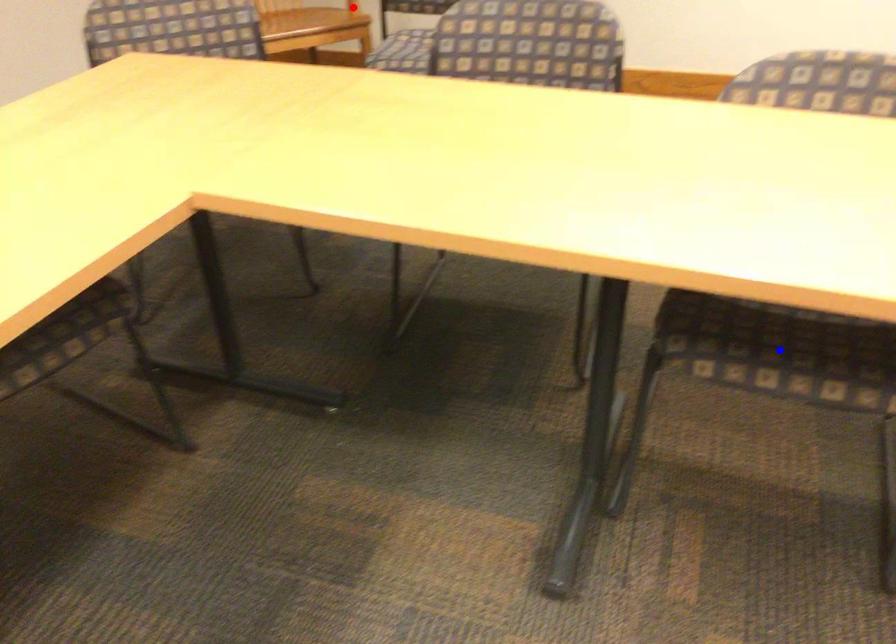
Question: Two points are marked on the image. Which point is closer to the camera?

Choices:
 (A) Blue point is closer.
 (B) Red point is closer.

Answer: (A)